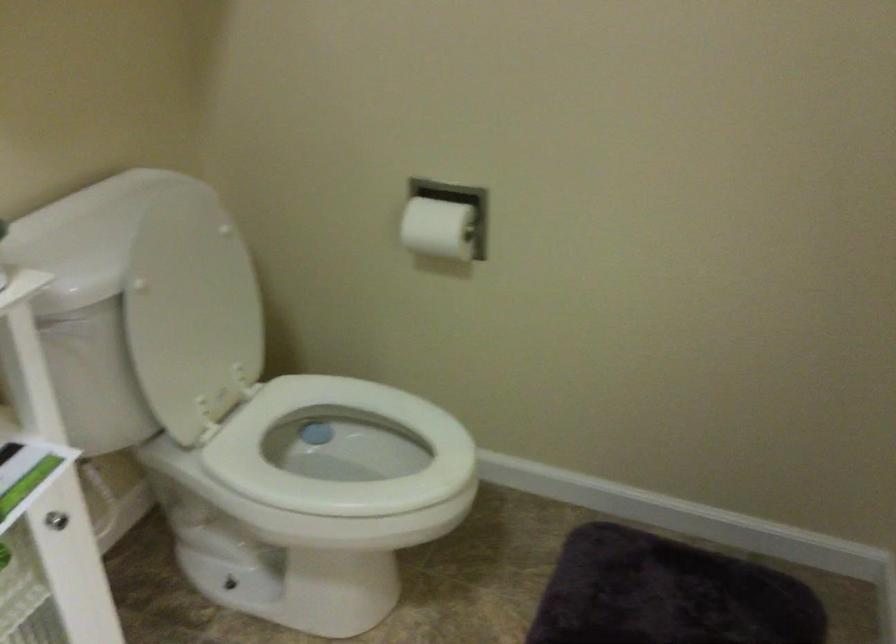
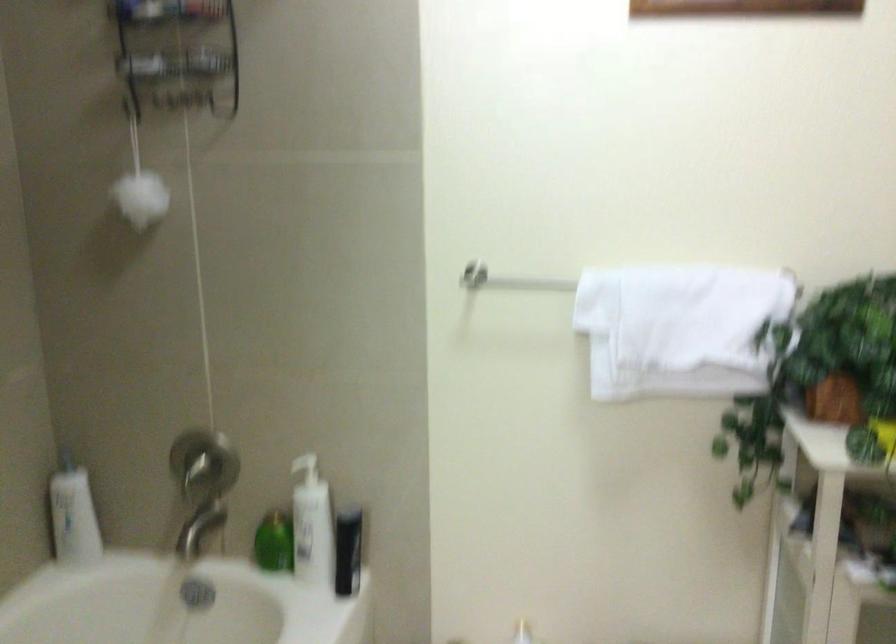
Question: The camera is either moving clockwise (left) or counter-clockwise (right) around the object. The first image is from the beginning of the video and the second image is from the end. Is the camera moving left or right when shooting the video?

Choices:
 (A) Left
 (B) Right

Answer: (B)